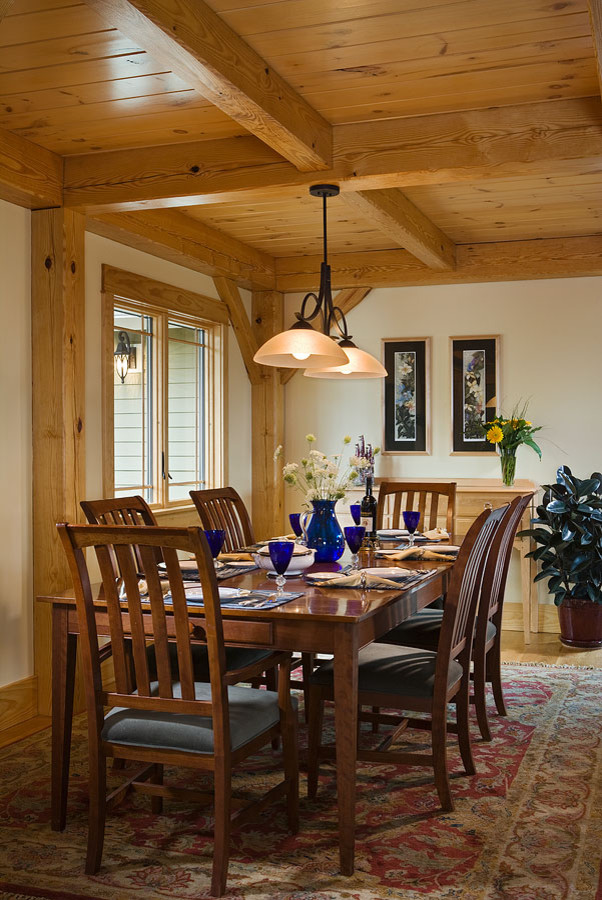
The width and height of the screenshot is (602, 900). I want to click on wall decor, so click(x=403, y=382), click(x=479, y=392).